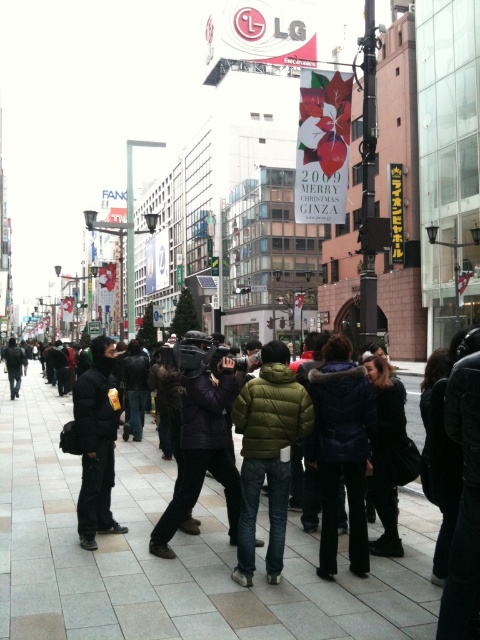
Which is below, velvet dark blue coat at center or matte purple jacket at center?

Positioned lower is velvet dark blue coat at center.

Where is `velvet dark blue coat at center`? This screenshot has width=480, height=640. velvet dark blue coat at center is located at coordinates (340, 451).

Find the location of a particular element. This screenshot has height=640, width=480. velvet dark blue coat at center is located at coordinates (340, 451).

Is velvet dark blue coat at center positioned at the back of black leather jacket at center?

No, velvet dark blue coat at center is closer to the viewer.

Between point (323, 554) and point (389, 516), which one is positioned behind?

Positioned behind is point (389, 516).

I want to click on velvet dark blue coat at center, so click(x=340, y=451).

Can you confirm if matte purple jacket at center is smaller than black leather jacket at center?

Actually, matte purple jacket at center might be larger than black leather jacket at center.

This screenshot has height=640, width=480. What do you see at coordinates (202, 451) in the screenshot?
I see `matte purple jacket at center` at bounding box center [202, 451].

Locate an element on the screen. The image size is (480, 640). matte purple jacket at center is located at coordinates (202, 451).